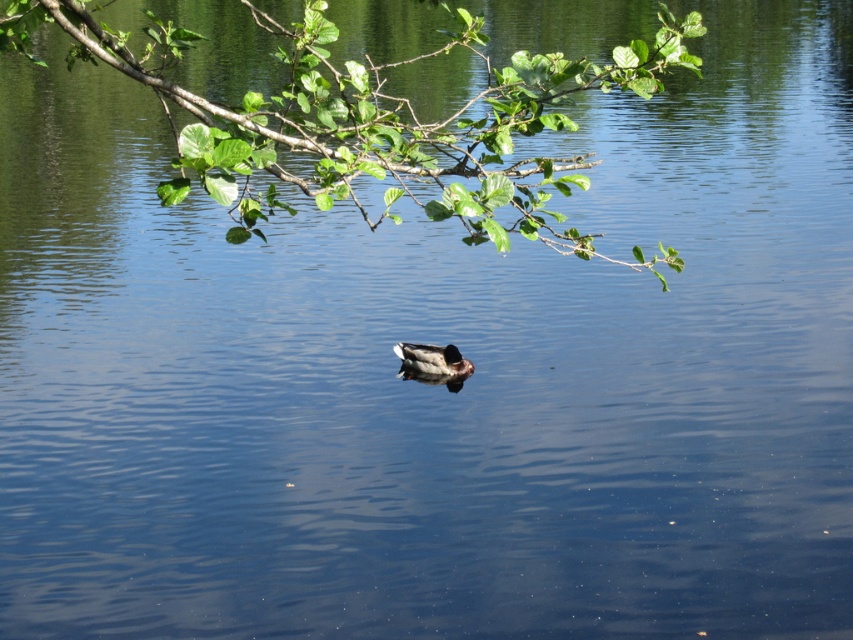
You are a bird flying over the lake and want to land on the nearest object. Which object would you choose between the green leafy branch at upper center and the brown matte duck at center?

The green leafy branch at upper center is larger in size than the brown matte duck at center, so you should land on the green leafy branch at upper center because it provides a more stable and spacious landing spot.

You are a photographer trying to capture the brown matte duck at center in focus while also including the green leafy branch at upper center in the background. Based on their positions, will the branch appear in front of or behind the duck in the photo?

The green leafy branch at upper center is closer to the viewer than the brown matte duck at center, so in the photo, the branch will appear in front of the duck.